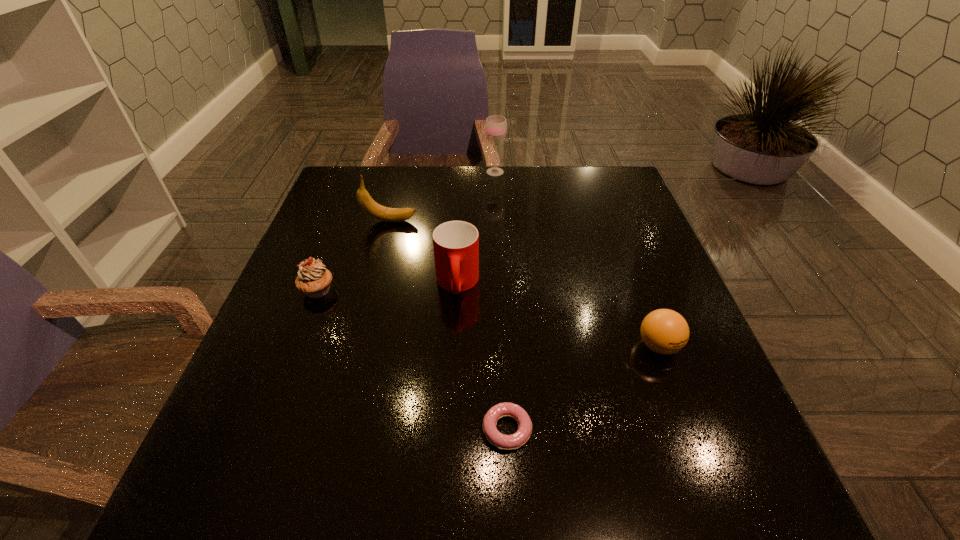
This screenshot has height=540, width=960. Identify the location of empty space between the second nearest object and the fifth object from right to left. (524, 284).

Identify the location of free point between the farthest object and the third object from left to right. The width and height of the screenshot is (960, 540). (476, 228).

Locate an element on the screen. The width and height of the screenshot is (960, 540). free space between the cup and the second nearest object is located at coordinates (558, 315).

The height and width of the screenshot is (540, 960). Identify the location of empty space that is in between the fifth nearest object and the farthest object. (443, 196).

Locate an element on the screen. The image size is (960, 540). free space between the leftmost object and the nearest object is located at coordinates (413, 360).

You are a GUI agent. You are given a task and a screenshot of the screen. Output one action in this format:
    pyautogui.click(x=<x>, y=<y>)
    Task: Click on the vacant space in between the cup and the farthest object
    This screenshot has height=540, width=960.
    Given the screenshot: What is the action you would take?
    pyautogui.click(x=476, y=228)

Find the location of `the fifth closest object to the fifth object from right to left`. the fifth closest object to the fifth object from right to left is located at coordinates (664, 331).

Identify which object is the fifth nearest to the banana. Please provide its 2D coordinates. Your answer should be formatted as a tuple, i.e. [(x, y)], where the tuple contains the x and y coordinates of a point satisfying the conditions above.

[(664, 331)]

Locate an element on the screen. The height and width of the screenshot is (540, 960). free spot that satisfies the following two spatial constraints: 1. on the side of the shortest object with the handle; 2. on the left side of the fourth object from right to left is located at coordinates (449, 429).

Image resolution: width=960 pixels, height=540 pixels. I want to click on vacant space that satisfies the following two spatial constraints: 1. on the front side of the shortest object; 2. on the right side of the cupcake, so click(265, 429).